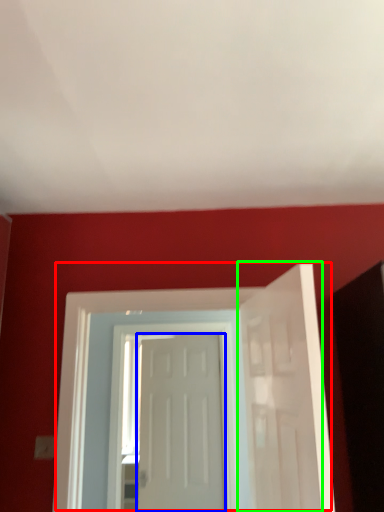
Question: Based on their relative distances, which object is nearer to door (highlighted by a red box)? Choose from door (highlighted by a blue box) and door (highlighted by a green box).

Choices:
 (A) door
 (B) door

Answer: (A)